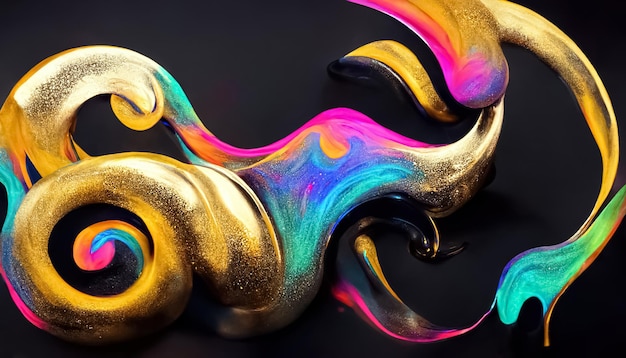
Where is `gold paint`? This screenshot has width=626, height=358. gold paint is located at coordinates (198, 222), (71, 83), (553, 43).